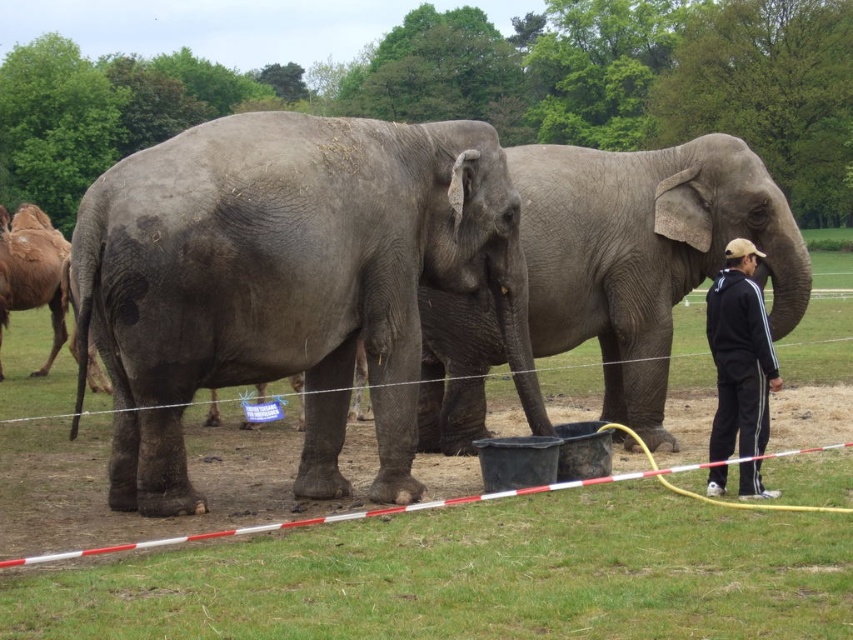
Question: Is gray matte elephant at center to the left of black track suit at right from the viewer's perspective?

Choices:
 (A) yes
 (B) no

Answer: (A)

Question: Which object is farther from the camera taking this photo?

Choices:
 (A) gray textured elephant at center
 (B) black track suit at right
 (C) gray matte elephant at center

Answer: (C)

Question: Considering the relative positions of gray textured elephant at center and gray matte elephant at center in the image provided, where is gray textured elephant at center located with respect to gray matte elephant at center?

Choices:
 (A) right
 (B) left

Answer: (B)

Question: Which point is farther to the camera?

Choices:
 (A) black track suit at right
 (B) gray textured elephant at center

Answer: (A)

Question: Does gray textured elephant at center appear under black track suit at right?

Choices:
 (A) no
 (B) yes

Answer: (A)

Question: Which of the following is the farthest from the observer?

Choices:
 (A) [x=614, y=266]
 (B) [x=741, y=419]
 (C) [x=514, y=333]

Answer: (A)